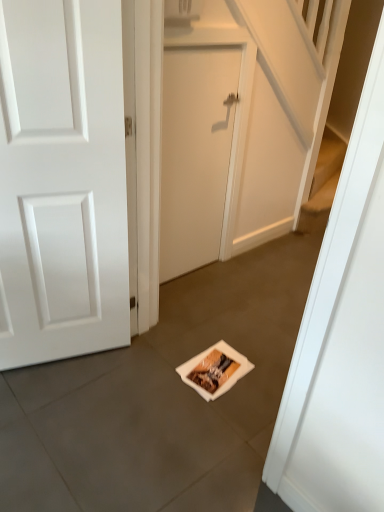
Question: In which direction should I rotate to look at beige matte door at center, which is counted as the 1th door, starting from the right?

Choices:
 (A) right
 (B) left

Answer: (A)

Question: From the image's perspective, is beige matte door at center, which is counted as the 1th door, starting from the right, beneath white matte door at left, arranged as the 1th door when viewed from the left?

Choices:
 (A) yes
 (B) no

Answer: (B)

Question: Can you confirm if beige matte door at center, which is counted as the 1th door, starting from the right, is shorter than white matte door at left, placed as the second door when sorted from right to left?

Choices:
 (A) yes
 (B) no

Answer: (A)

Question: Can you confirm if beige matte door at center, positioned as the second door in left-to-right order, is positioned to the right of white matte door at left, arranged as the 1th door when viewed from the left?

Choices:
 (A) no
 (B) yes

Answer: (B)

Question: Would you say beige matte door at center, positioned as the second door in left-to-right order, contains white matte door at left, arranged as the 1th door when viewed from the left?

Choices:
 (A) yes
 (B) no

Answer: (B)

Question: Are beige matte door at center, positioned as the second door in left-to-right order, and white matte door at left, placed as the second door when sorted from right to left, far apart?

Choices:
 (A) yes
 (B) no

Answer: (B)

Question: Does beige matte door at center, which is counted as the 1th door, starting from the right, have a larger size compared to white matte door at left, arranged as the 1th door when viewed from the left?

Choices:
 (A) yes
 (B) no

Answer: (B)

Question: From the image's perspective, would you say white matte door at left, placed as the second door when sorted from right to left, is shown under beige matte door at center, which is counted as the 1th door, starting from the right?

Choices:
 (A) yes
 (B) no

Answer: (A)

Question: From the image's perspective, is white matte door at left, placed as the second door when sorted from right to left, on beige matte door at center, which is counted as the 1th door, starting from the right?

Choices:
 (A) yes
 (B) no

Answer: (B)

Question: Does white matte door at left, placed as the second door when sorted from right to left, have a greater height compared to beige matte door at center, positioned as the second door in left-to-right order?

Choices:
 (A) yes
 (B) no

Answer: (A)

Question: Does white matte door at left, placed as the second door when sorted from right to left, have a lesser height compared to beige matte door at center, which is counted as the 1th door, starting from the right?

Choices:
 (A) yes
 (B) no

Answer: (B)

Question: Can beige matte door at center, positioned as the second door in left-to-right order, be found inside white matte door at left, arranged as the 1th door when viewed from the left?

Choices:
 (A) no
 (B) yes

Answer: (A)

Question: Would you consider white matte door at left, placed as the second door when sorted from right to left, to be distant from beige matte door at center, which is counted as the 1th door, starting from the right?

Choices:
 (A) yes
 (B) no

Answer: (B)

Question: Is beige matte door at center, positioned as the second door in left-to-right order, inside the boundaries of white matte door at left, arranged as the 1th door when viewed from the left, or outside?

Choices:
 (A) outside
 (B) inside

Answer: (A)